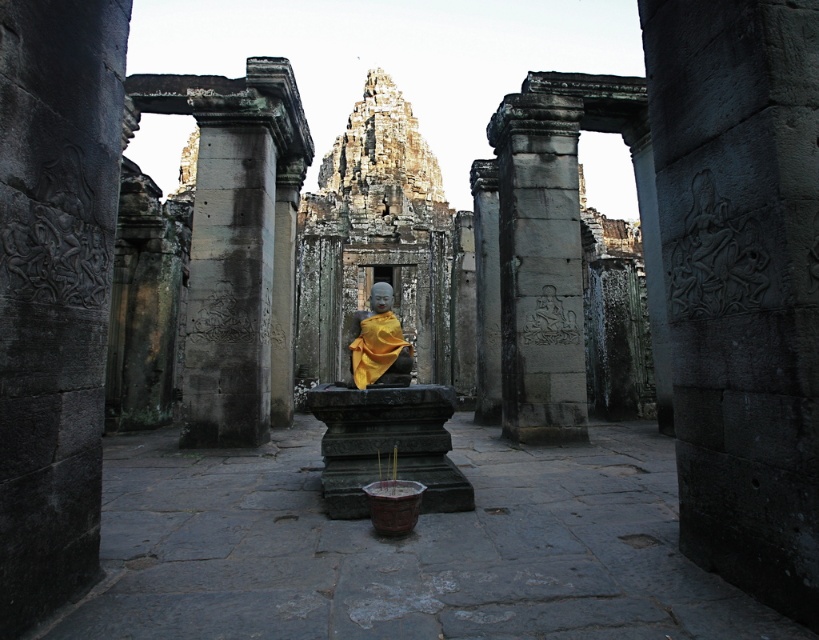
Question: Considering the relative positions of gray stone carving at center and yellow fabric statue at center in the image provided, where is gray stone carving at center located with respect to yellow fabric statue at center?

Choices:
 (A) below
 (B) above

Answer: (A)

Question: Which object appears farthest from the camera in this image?

Choices:
 (A) carved stone relief at center
 (B) gray stone pillar at center
 (C) yellow fabric statue at center

Answer: (B)

Question: Does carved stone relief at center appear over yellow fabric statue at center?

Choices:
 (A) yes
 (B) no

Answer: (B)

Question: Which point is farther to the camera?

Choices:
 (A) (370, 321)
 (B) (745, 358)

Answer: (A)

Question: Which point appears closest to the camera in this image?

Choices:
 (A) (794, 228)
 (B) (191, 380)

Answer: (A)

Question: Can you confirm if gray stone pillar at center is bigger than yellow fabric statue at center?

Choices:
 (A) yes
 (B) no

Answer: (B)